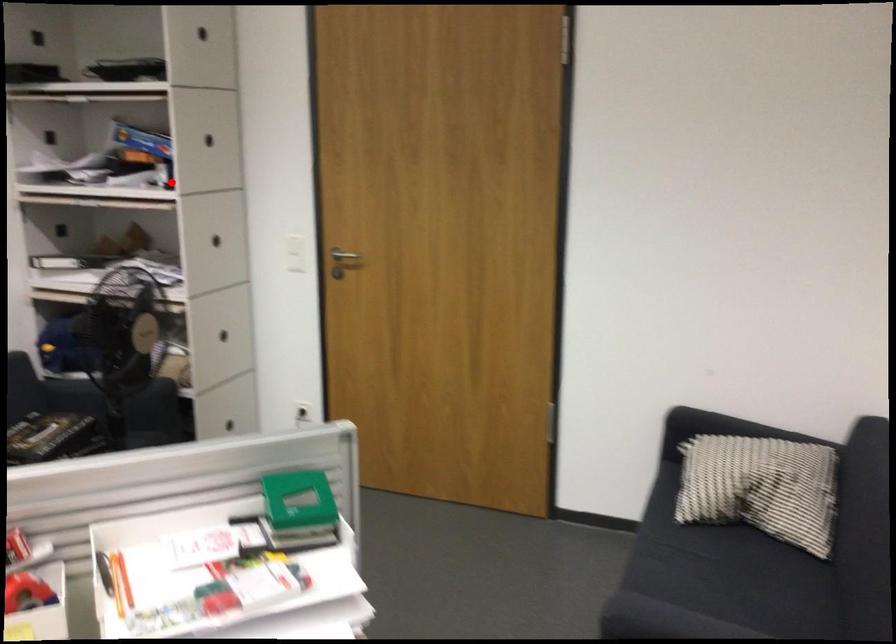
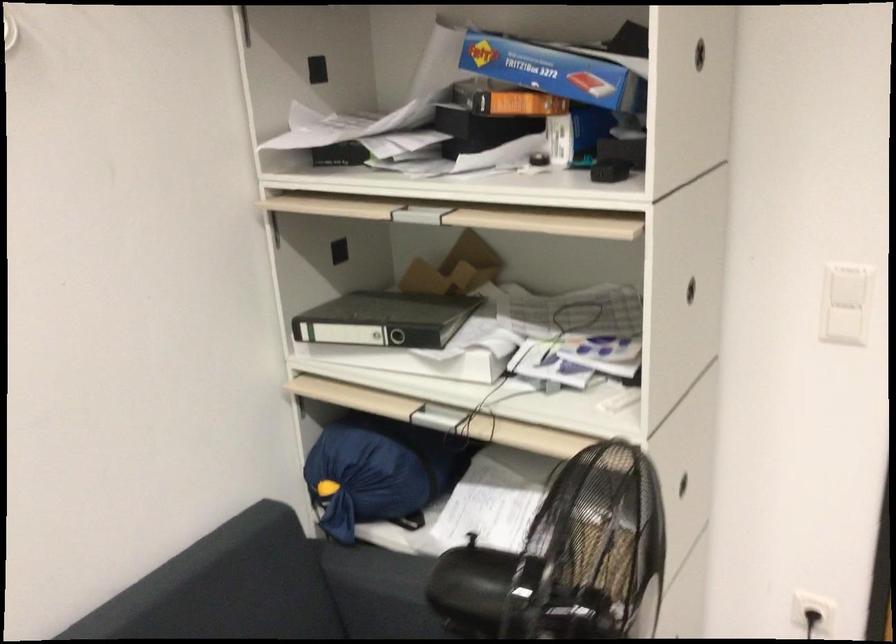
In the second image, find the point that corresponds to the highlighted location in the first image.

(608, 171)